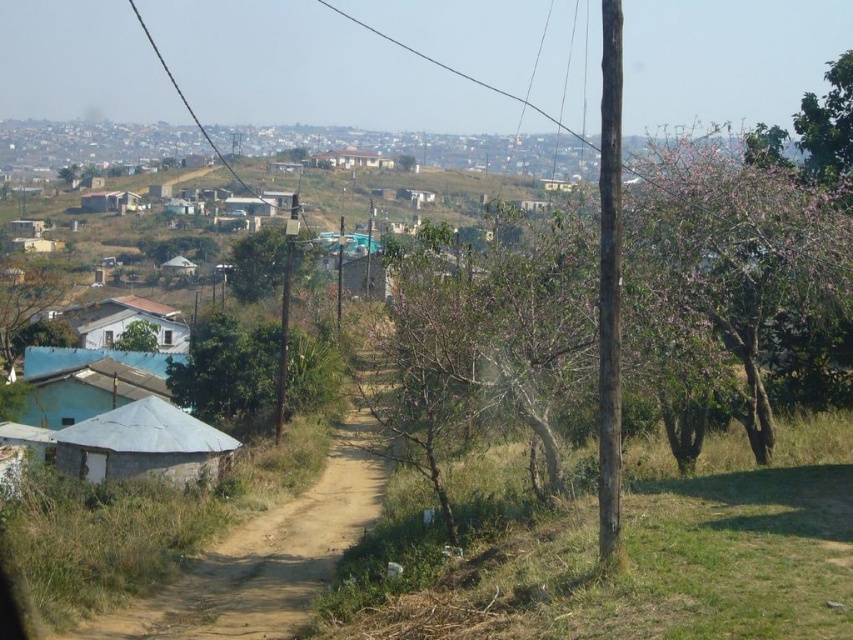
Is white corrugated metal hut at lower left thinner than white matte house at center?

Yes.

What do you see at coordinates (143, 444) in the screenshot? I see `white corrugated metal hut at lower left` at bounding box center [143, 444].

Who is more distant from viewer, [198,440] or [85,323]?

The point [85,323] is more distant.

What are the coordinates of `white corrugated metal hut at lower left` in the screenshot? It's located at (143, 444).

Between brown wooden telegraph pole at right and brown wooden telegraph pole at center, which one has more height?

With more height is brown wooden telegraph pole at right.

Is brown wooden telegraph pole at right further to the viewer compared to brown wooden telegraph pole at center?

No, brown wooden telegraph pole at right is in front of brown wooden telegraph pole at center.

Identify the location of brown wooden telegraph pole at right. (608, 282).

Measure the distance between green leafy tree at upper right and camera.

16.62 meters

Identify the location of green leafy tree at upper right. (828, 125).